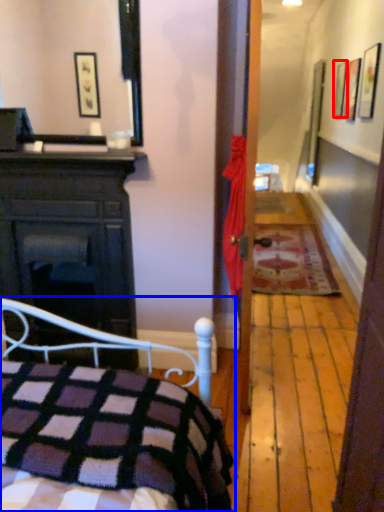
Question: Which point is closer to the camera, picture frame (highlighted by a red box) or bed (highlighted by a blue box)?

Choices:
 (A) picture frame
 (B) bed

Answer: (B)